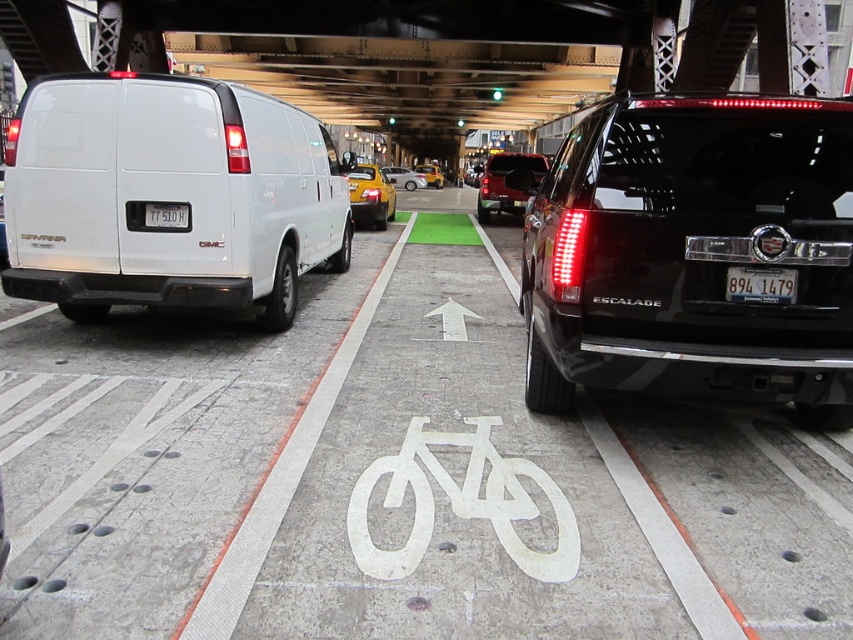
You are a cyclist approaching the bike lane and need to navigate around two parked vehicles. The first vehicle is at point (492, 182) and the second is at point (370, 195). Which vehicle should you approach first based on their positions relative to your viewpoint?

You should approach the vehicle at point (492, 182) first because it is closer to you than the vehicle at point (370, 195), which is further away.

You are a cyclist planning to ride through the bike lane in the city street scene. There is a white painted bicycle at center. Where exactly is the white painted bicycle located in the scene?

The white painted bicycle at center is located at the 2D coordinates point (460, 502) in the scene.

You are a cyclist approaching the bike lane marked by a white bicycle symbol at center. There is a parked white GMC Savana van at point (460, 502). Can you safely ride through the bike lane without going around the van?

The point (460, 502) where the white GMC Savana van is parked is located on the white painted bicycle symbol at center, meaning the van is blocking the bike lane. Therefore, you cannot safely ride through the bike lane without going around the van.